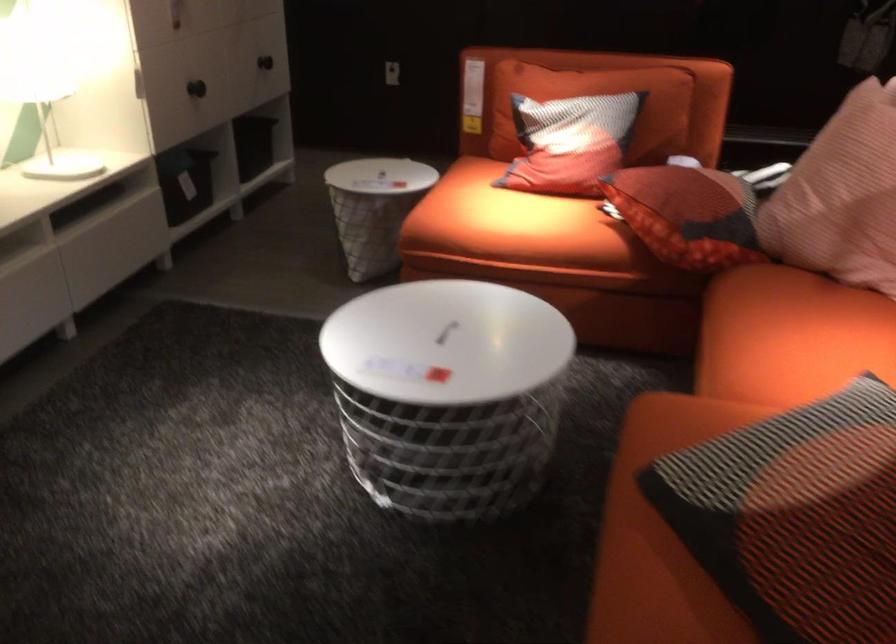
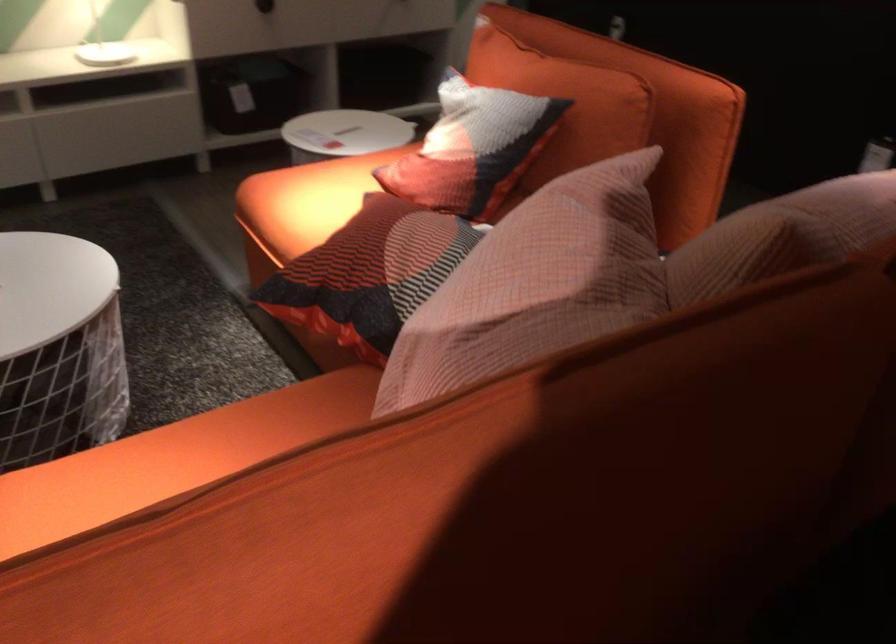
Locate, in the second image, the point that corresponds to point (640, 88) in the first image.

(564, 102)